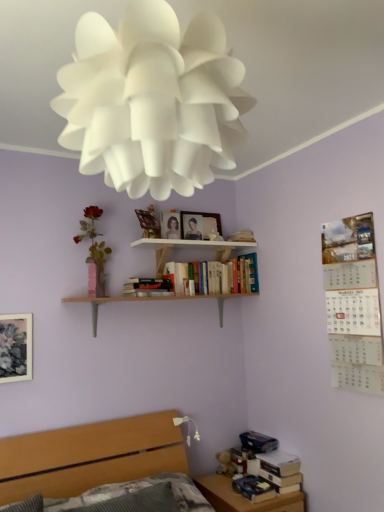
The height and width of the screenshot is (512, 384). In order to click on free spot above hardcover book at lower right, positioned as the second book in bottom-to-top order (from a real-world perspective) in this screenshot , I will do `click(280, 460)`.